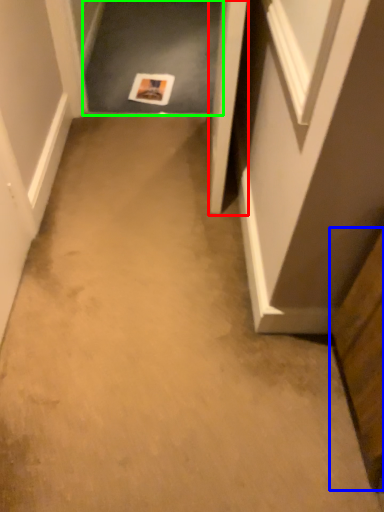
Question: Which object is positioned closest to door (highlighted by a red box)? Select from cabinetry (highlighted by a blue box) and passage (highlighted by a green box).

Choices:
 (A) cabinetry
 (B) passage

Answer: (A)